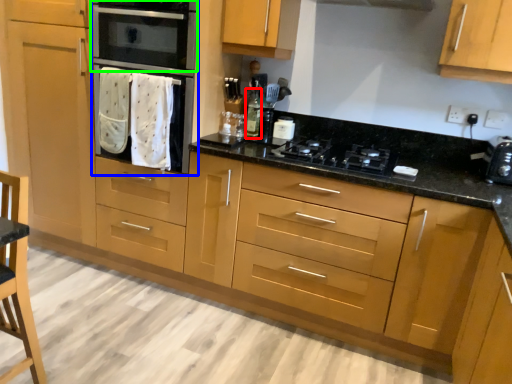
Question: Which object is positioned farthest from bottle (highlighted by a red box)? Select from oven (highlighted by a blue box) and home appliance (highlighted by a green box).

Choices:
 (A) oven
 (B) home appliance

Answer: (B)